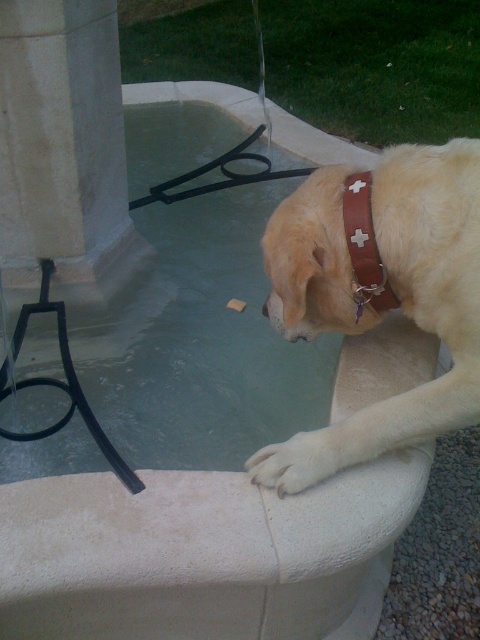
You are a photographer trying to capture the light brown leather collar at upper right and the white stone pillar at left in the same frame. Based on their positions, which object is closer to the bottom edge of your camera view?

The light brown leather collar at upper right is located below the white stone pillar at left, so the collar is closer to the bottom edge of the camera view.

You are a dog owner who wants to ensure your dog stays safe near the fountain. Based on the scene, which object is positioned higher up, the light brown leather collar at upper right or the white fur paw at lower center?

The light brown leather collar at upper right is taller than the white fur paw at lower center, so the collar is positioned higher up.

Based on the photo, you are a dog owner who wants to attach a GPS tracker to your dog. The GPS tracker requires a spot on the dog that is above the collar. Which object on the dog should you choose between the light brown leather collar at upper right and the brown leather neckband at upper right?

The brown leather neckband at upper right is above the light brown leather collar at upper right, so you should choose the brown leather neckband at upper right to attach the GPS tracker.